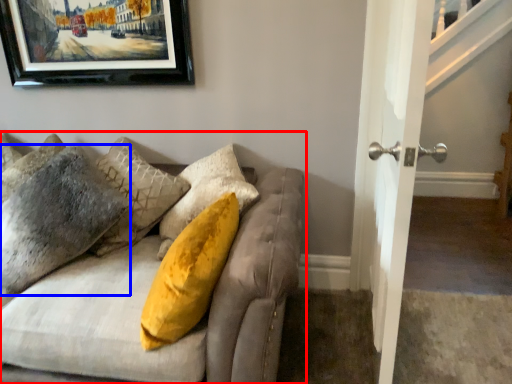
Question: Which object is further to the camera taking this photo, studio couch (highlighted by a red box) or pillow (highlighted by a blue box)?

Choices:
 (A) studio couch
 (B) pillow

Answer: (B)